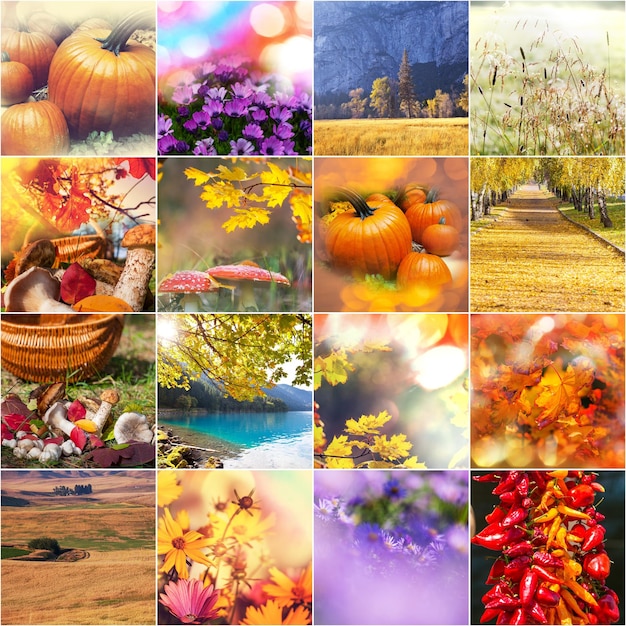
Find the location of a particular element. The height and width of the screenshot is (626, 626). corner boxes is located at coordinates (560, 96), (101, 109), (98, 490), (518, 481).